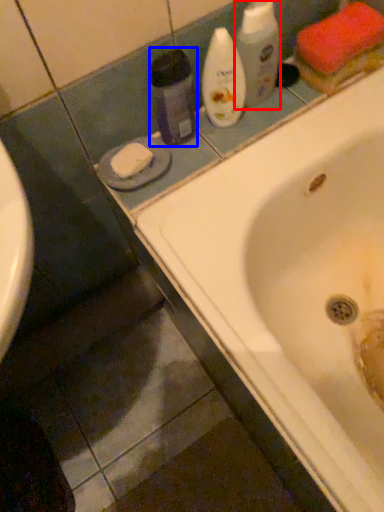
Question: Which of the following is the farthest to the observer, cleaning product (highlighted by a red box) or cleaning product (highlighted by a blue box)?

Choices:
 (A) cleaning product
 (B) cleaning product

Answer: (A)